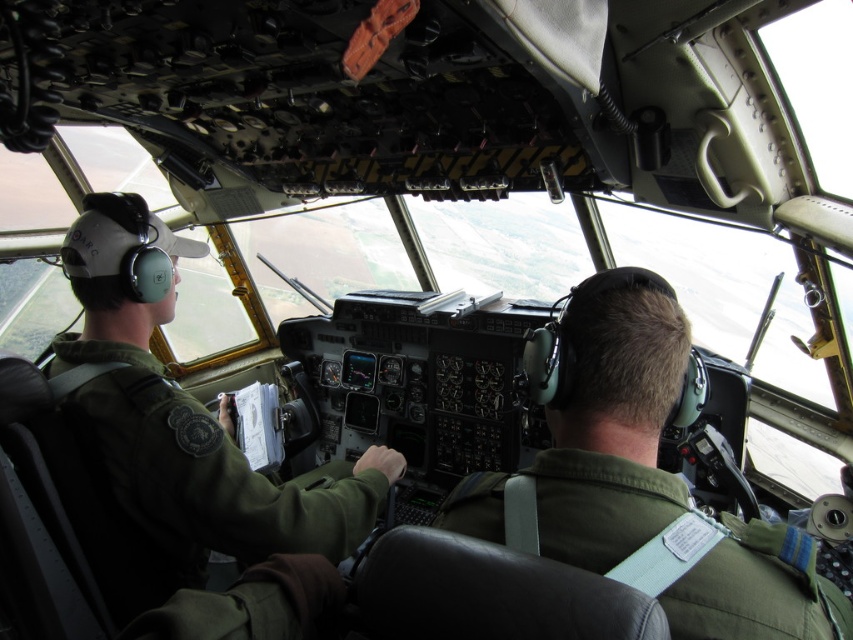
You are a technician standing 30 inches away from the cockpit entrance. You need to reach the green fabric pilot at center to hand them a critical document. Can you reach them without moving closer?

The green fabric pilot at center is 28.12 inches away from viewer, so yes, the technician can reach them without moving closer since the distance is within the 30 inches range.

You are a passenger sitting in the back of the aircraft. You notice two green fabric items in the cockpit. Which one is closer to you, the green fabric pilot at center or the green fabric uniform at left?

The green fabric pilot at center is closer to you than the green fabric uniform at left.